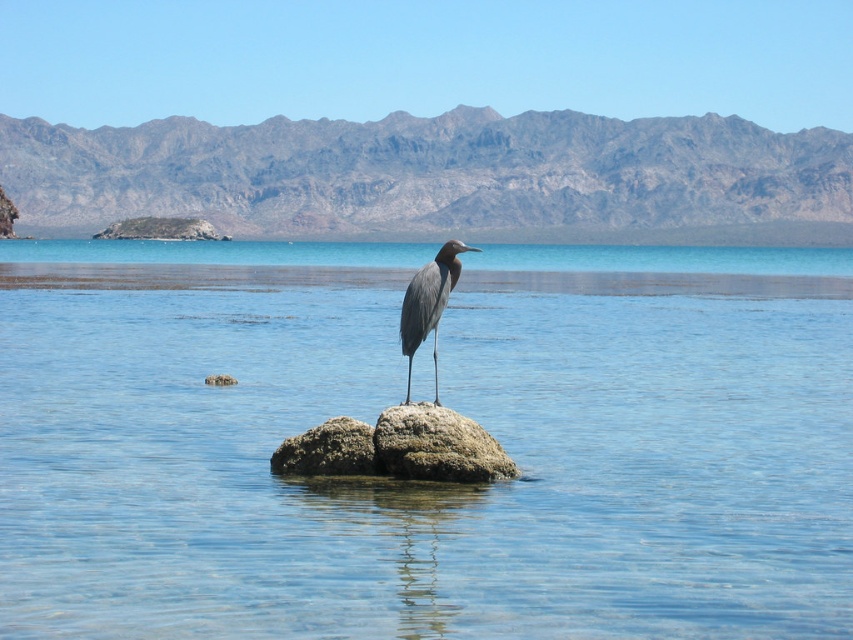
You are a photographer trying to capture the gray matte bird at center in your shot. The clear water at center might block the view. Can you adjust your position so the bird is fully visible without the water obstructing it?

The clear water at center is taller than the gray matte bird at center, so adjusting your position to look from above or the side where the water is lower could allow the bird to be fully visible without obstruction.

You are a drone operator trying to capture a closeup of the rusty concrete rock at center. Your drone is currently at the coordinates of the heron. What direction should you move the drone to reach the rock?

The rusty concrete rock at center is located at coordinates point (328, 451). Since the heron is standing on two rocks protruding from the water, the drone should move towards the coordinates provided to reach the rusty concrete rock at center.